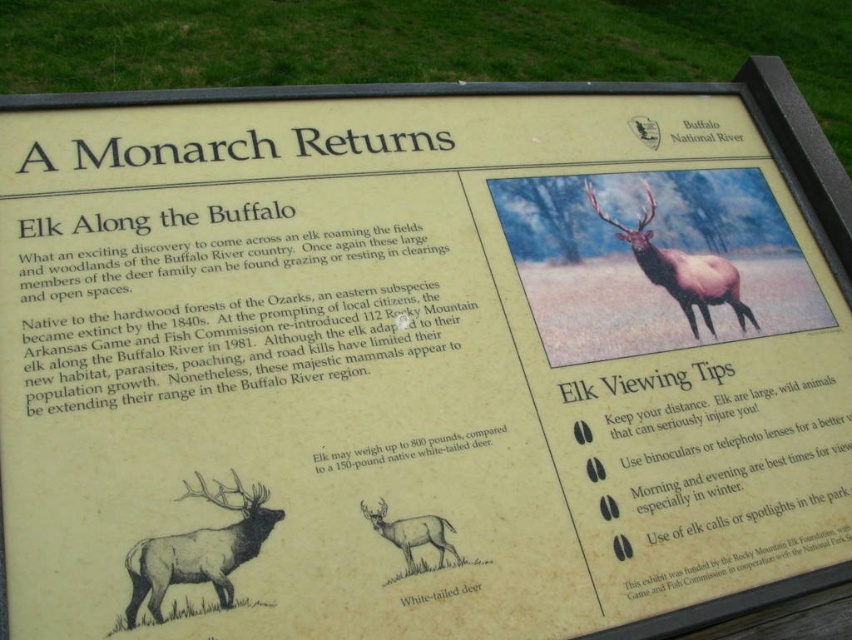
Does brown sketchy elk at lower left come behind brown sketchy deer at center?

No.

Can you confirm if brown sketchy elk at lower left is thinner than brown sketchy deer at center?

Incorrect, brown sketchy elk at lower left's width is not less than brown sketchy deer at center's.

Is point (234, 557) closer to camera compared to point (441, 563)?

That is True.

Locate an element on the screen. The width and height of the screenshot is (852, 640). brown sketchy elk at lower left is located at coordinates (200, 548).

Is brown sketchy elk at lower left wider than shiny brown elk at center?

No.

Is brown sketchy elk at lower left further to camera compared to shiny brown elk at center?

No, brown sketchy elk at lower left is closer to the viewer.

Which is in front, point (153, 563) or point (655, 246)?

Positioned in front is point (153, 563).

Find the location of a particular element. The width and height of the screenshot is (852, 640). brown sketchy elk at lower left is located at coordinates (200, 548).

Who is more distant from viewer, (721, 266) or (409, 545)?

Positioned behind is point (721, 266).

How much distance is there between shiny brown elk at center and brown sketchy deer at center?

shiny brown elk at center and brown sketchy deer at center are 29.18 inches apart.

Is point (734, 273) positioned in front of point (436, 529)?

No, it is behind (436, 529).

The height and width of the screenshot is (640, 852). What are the coordinates of `shiny brown elk at center` in the screenshot? It's located at (681, 269).